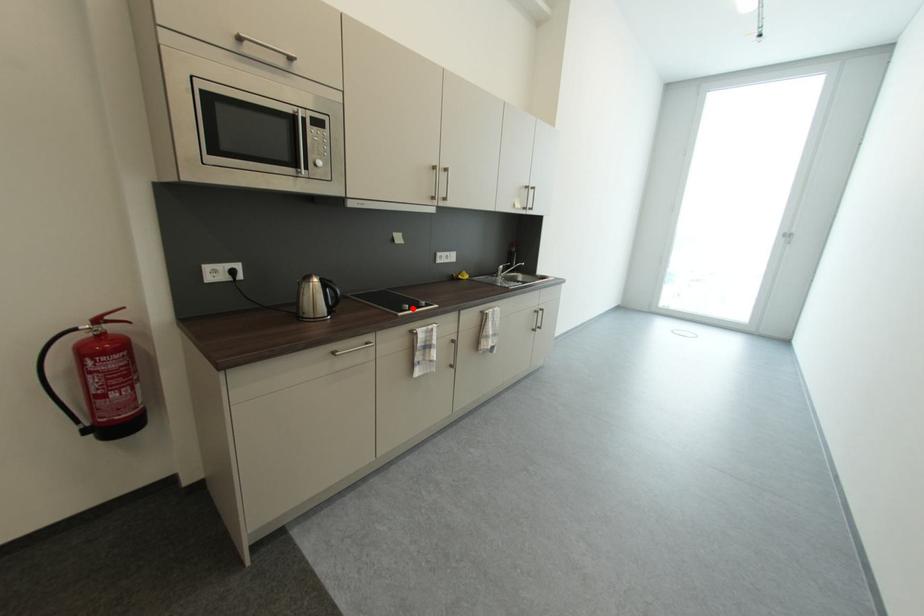
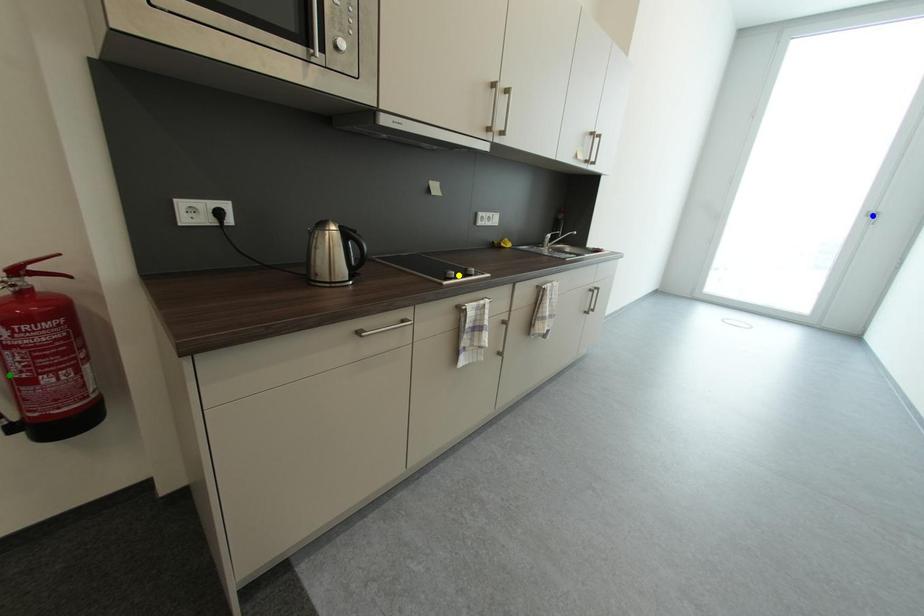
Question: I am providing you with two images of the same scene from different viewpoints. A red point is marked on the first image. You are given multiple points on the second image. Can you choose the point in image 2 that corresponds to the point in image 1?

Choices:
 (A) green point
 (B) blue point
 (C) yellow point

Answer: (C)